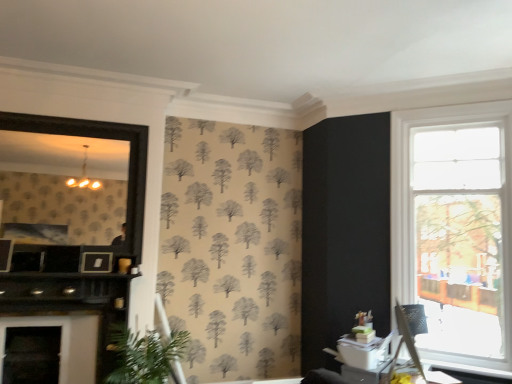
Question: Is black matte fireplace at left closer to the viewer compared to white glossy table at lower right?

Choices:
 (A) yes
 (B) no

Answer: (A)

Question: Considering the relative positions of black matte fireplace at left and white glossy table at lower right in the image provided, is black matte fireplace at left to the left of white glossy table at lower right from the viewer's perspective?

Choices:
 (A) no
 (B) yes

Answer: (B)

Question: Does black matte fireplace at left turn towards white glossy table at lower right?

Choices:
 (A) no
 (B) yes

Answer: (A)

Question: Is black matte fireplace at left turned away from white glossy table at lower right?

Choices:
 (A) no
 (B) yes

Answer: (A)

Question: Is black matte fireplace at left in contact with white glossy table at lower right?

Choices:
 (A) no
 (B) yes

Answer: (A)

Question: Can you confirm if black matte fireplace at left is taller than white glossy table at lower right?

Choices:
 (A) yes
 (B) no

Answer: (A)

Question: Can we say clear glass window at right lies outside black matte fireplace at left?

Choices:
 (A) yes
 (B) no

Answer: (A)

Question: Considering the relative sizes of clear glass window at right and black matte fireplace at left in the image provided, is clear glass window at right taller than black matte fireplace at left?

Choices:
 (A) no
 (B) yes

Answer: (B)

Question: Is clear glass window at right placed right next to black matte fireplace at left?

Choices:
 (A) yes
 (B) no

Answer: (B)

Question: Is clear glass window at right closer to the viewer compared to black matte fireplace at left?

Choices:
 (A) no
 (B) yes

Answer: (B)

Question: Can you confirm if clear glass window at right is positioned to the left of black matte fireplace at left?

Choices:
 (A) no
 (B) yes

Answer: (A)

Question: Is clear glass window at right oriented towards black matte fireplace at left?

Choices:
 (A) no
 (B) yes

Answer: (A)

Question: Is green leafy plant at lower left positioned in front of black matte fireplace at left?

Choices:
 (A) no
 (B) yes

Answer: (B)